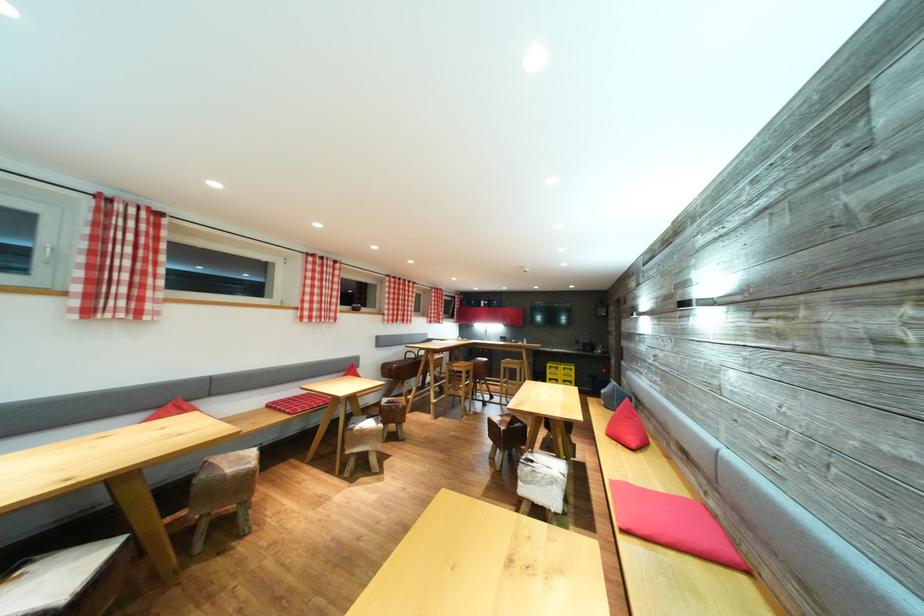
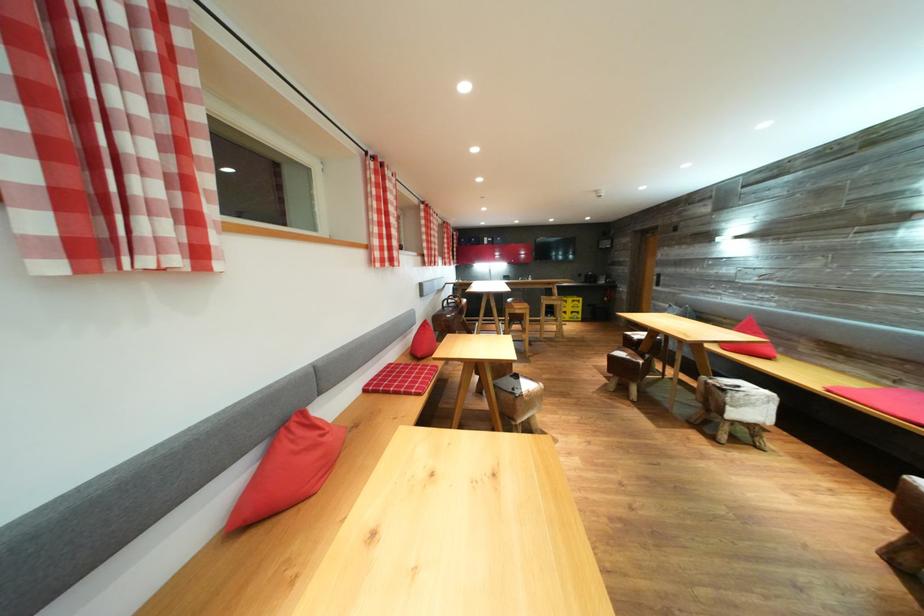
The point at (186, 413) is marked in the first image. Where is the corresponding point in the second image?

(320, 431)